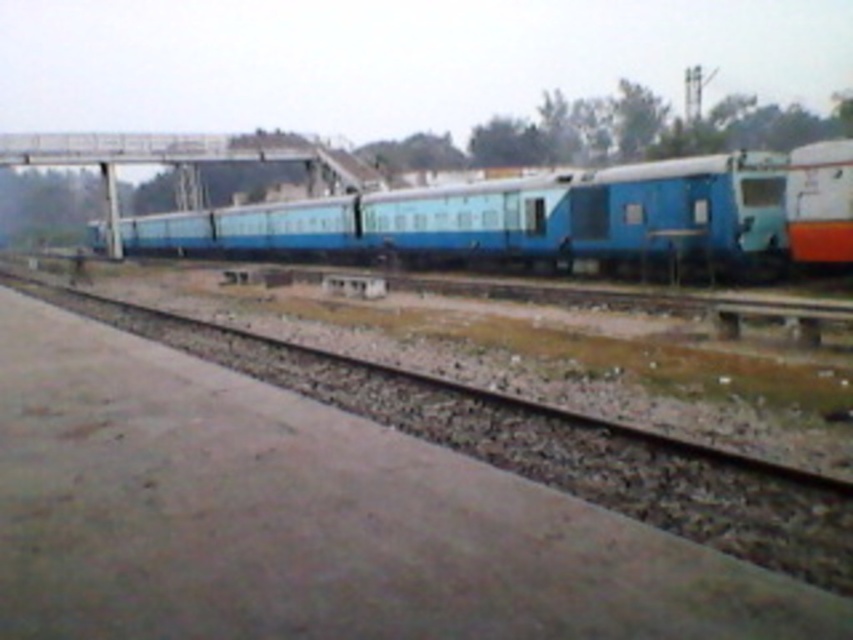
Question: Where is blue matte train car at center located in relation to brown gravel track at lower left in the image?

Choices:
 (A) left
 (B) right

Answer: (A)

Question: Among these points, which one is nearest to the camera?

Choices:
 (A) (796, 246)
 (B) (689, 157)

Answer: (A)

Question: Does blue matte train car at center come in front of brown gravel track at lower left?

Choices:
 (A) yes
 (B) no

Answer: (B)

Question: Which is farther from the orange glossy train car at right?

Choices:
 (A) brown gravel track at lower left
 (B) blue matte train car at center

Answer: (B)

Question: Which point is closer to the camera?

Choices:
 (A) (851, 218)
 (B) (137, 310)

Answer: (A)

Question: Observing the image, what is the correct spatial positioning of blue matte train car at center in reference to orange glossy train car at right?

Choices:
 (A) left
 (B) right

Answer: (A)